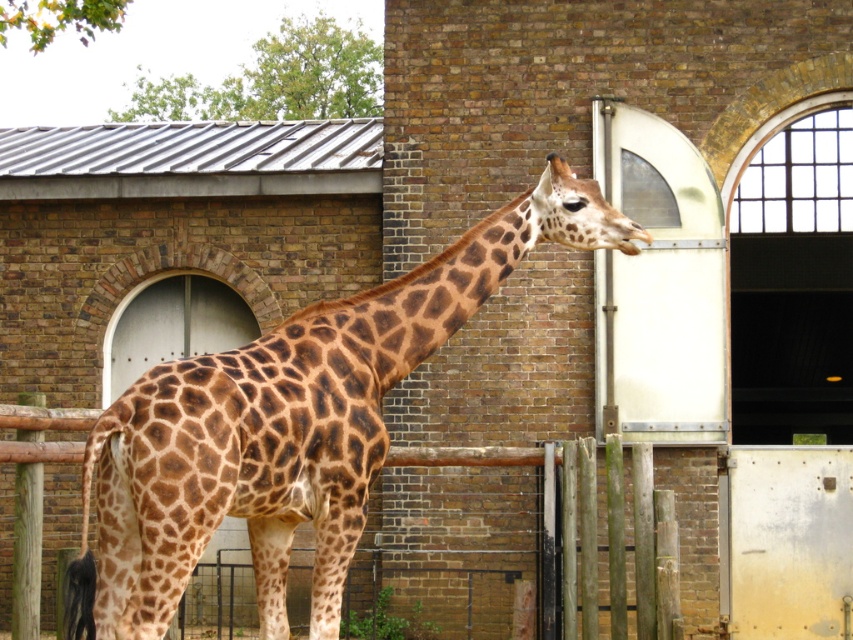
You are a zookeeper trying to feed the brown spotted giraffe at center and the wooden at center. Which one should you approach first if you want to feed the one closer to the left side?

You should approach the brown spotted giraffe at center first because it is positioned to the left of the wooden at center, making it closer to the left side.